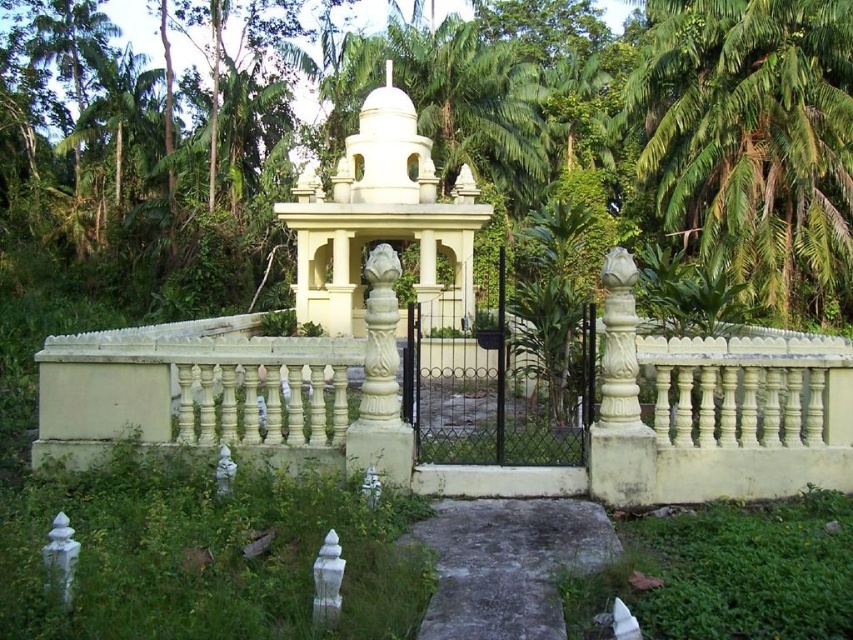
Based on the photo, you are planning to install a new lighting system for the white stone gazebo at center and the green leafy palm tree at upper right. The lighting for the palm tree requires taller poles than the gazebo. Based on the scene, will you need different pole heights for each object?

Yes, the green leafy palm tree at upper right is much taller than the white stone gazebo at center, so you will need taller poles for the palm tree and shorter ones for the gazebo.

You are standing in front of the temple or mausoleum structure and want to take a photo that includes both the green leafy palm tree at upper right and the entire structure. Given that your camera has a maximum zoom of 5 meters, will you be able to capture both in a single frame without moving closer or further away?

The green leafy palm tree at upper right is 17.12 meters away from the viewer. Since the camera can only zoom up to 5 meters, you will not be able to capture both the palm tree and the entire structure in a single frame without moving closer or further away.

You are standing in front of the temple and want to walk towards the white stone gazebo at center. Which direction should you move relative to the white stone fence at center?

To reach the white stone gazebo at center from the temple, you should move to the right side of the white stone fence at center since the white stone fence at center is positioned on the left side of the white stone gazebo at center.